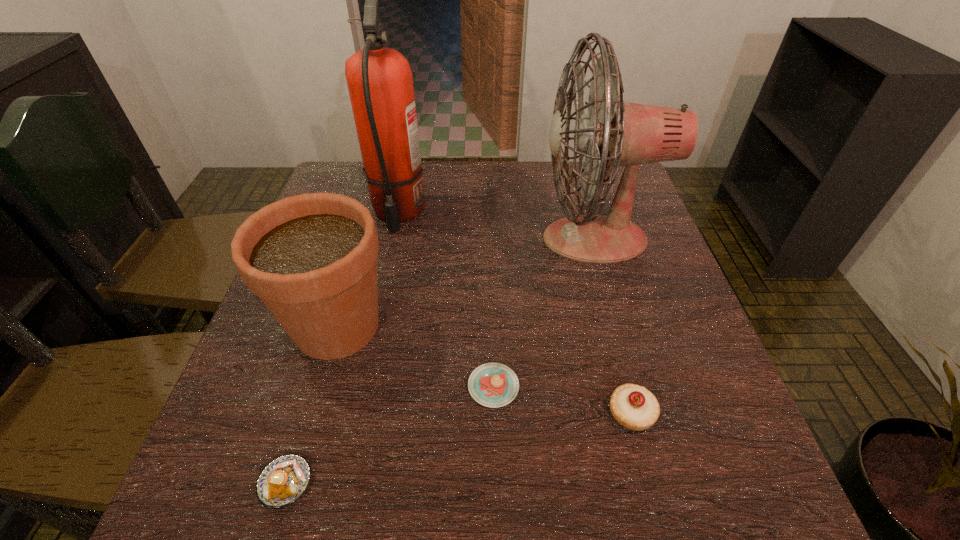
The image size is (960, 540). I want to click on vacant area between the third tallest object and the fan, so click(466, 282).

Where is `vacant space that's between the fourth object from left to right and the fan`? vacant space that's between the fourth object from left to right and the fan is located at coordinates (544, 313).

What are the coordinates of `the fifth closest object to the fan` in the screenshot? It's located at (282, 481).

Select which object appears as the fourth closest to the fire extinguisher. Please provide its 2D coordinates. Your answer should be formatted as a tuple, i.e. [(x, y)], where the tuple contains the x and y coordinates of a point satisfying the conditions above.

[(282, 481)]

Point out which pastry is positioned as the nearest to the leftmost pastry. Please provide its 2D coordinates. Your answer should be formatted as a tuple, i.e. [(x, y)], where the tuple contains the x and y coordinates of a point satisfying the conditions above.

[(493, 385)]

Locate which pastry is the second closest to the fire extinguisher. Please provide its 2D coordinates. Your answer should be formatted as a tuple, i.e. [(x, y)], where the tuple contains the x and y coordinates of a point satisfying the conditions above.

[(282, 481)]

Where is `vacant space that satisfies the following two spatial constraints: 1. on the front side of the third object from right to left; 2. on the left side of the tallest pastry`? vacant space that satisfies the following two spatial constraints: 1. on the front side of the third object from right to left; 2. on the left side of the tallest pastry is located at coordinates (494, 413).

Image resolution: width=960 pixels, height=540 pixels. Find the location of `vacant point that satisfies the following two spatial constraints: 1. on the front side of the fourth shortest object; 2. on the left side of the fourth object from left to right`. vacant point that satisfies the following two spatial constraints: 1. on the front side of the fourth shortest object; 2. on the left side of the fourth object from left to right is located at coordinates (320, 387).

Where is `blank space that satisfies the following two spatial constraints: 1. in front of the fan to direct airflow; 2. on the front side of the rightmost pastry`? blank space that satisfies the following two spatial constraints: 1. in front of the fan to direct airflow; 2. on the front side of the rightmost pastry is located at coordinates (644, 413).

Locate an element on the screen. vacant position in the image that satisfies the following two spatial constraints: 1. on the nozzle of the second pastry from right to left; 2. on the left side of the fire extinguisher is located at coordinates tap(360, 387).